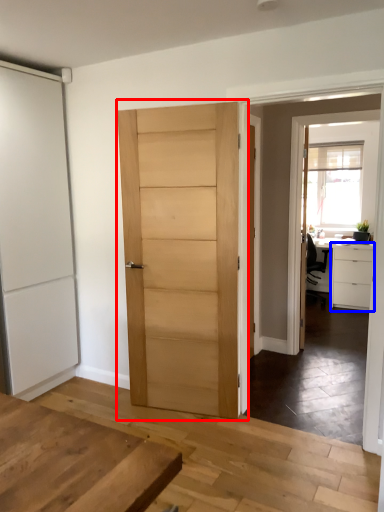
Question: Which object is closer to the camera taking this photo, door (highlighted by a red box) or cabinetry (highlighted by a blue box)?

Choices:
 (A) door
 (B) cabinetry

Answer: (A)